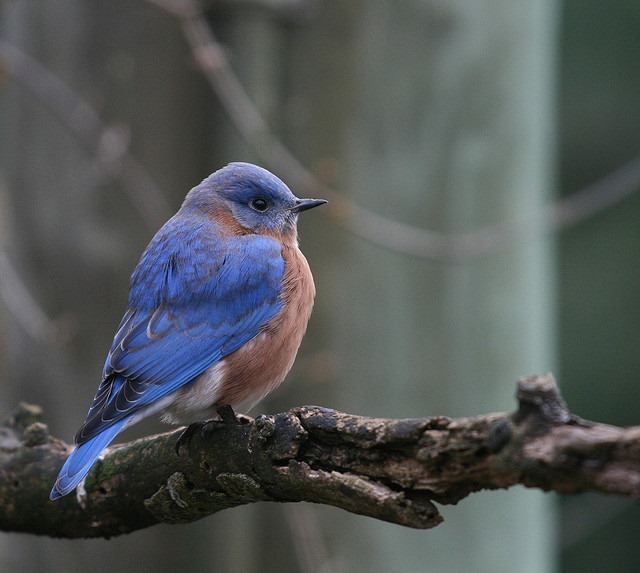
Image resolution: width=640 pixels, height=573 pixels. Identify the location of chest. (289, 337).